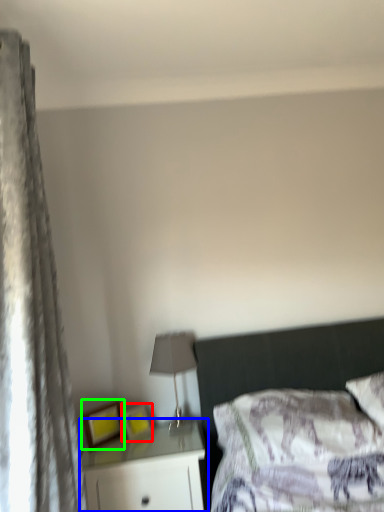
Question: Which is nearer to the picture frame (highlighted by a red box)? nightstand (highlighted by a blue box) or picture frame (highlighted by a green box).

Choices:
 (A) nightstand
 (B) picture frame

Answer: (B)